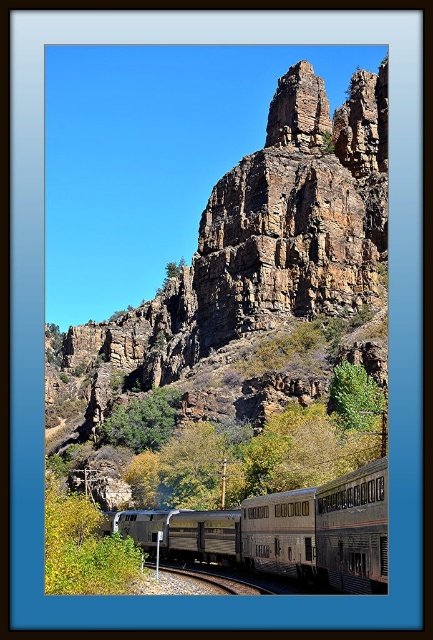
Is point (128, 525) behind point (183, 568)?

Yes, point (128, 525) is behind point (183, 568).

Who is positioned more to the right, silver metallic train at center or metal/smooth track at lower center?

From the viewer's perspective, silver metallic train at center appears more on the right side.

Who is more forward, (365, 481) or (196, 577)?

Point (365, 481)

The height and width of the screenshot is (640, 433). I want to click on silver metallic train at center, so click(x=281, y=532).

Does rugged brown rock formation at center appear on the right side of metal/smooth track at lower center?

Incorrect, rugged brown rock formation at center is not on the right side of metal/smooth track at lower center.

Who is lower down, rugged brown rock formation at center or metal/smooth track at lower center?

metal/smooth track at lower center

The image size is (433, 640). What do you see at coordinates (245, 320) in the screenshot?
I see `rugged brown rock formation at center` at bounding box center [245, 320].

I want to click on rugged brown rock formation at center, so click(245, 320).

Does rugged brown rock formation at center have a greater height compared to silver metallic train at center?

Yes, rugged brown rock formation at center is taller than silver metallic train at center.

Who is positioned more to the left, rugged brown rock formation at center or silver metallic train at center?

rugged brown rock formation at center is more to the left.

Is point (194, 337) closer to camera compared to point (151, 536)?

No, (194, 337) is behind (151, 536).

The width and height of the screenshot is (433, 640). Find the location of `rugged brown rock formation at center`. rugged brown rock formation at center is located at coordinates (245, 320).